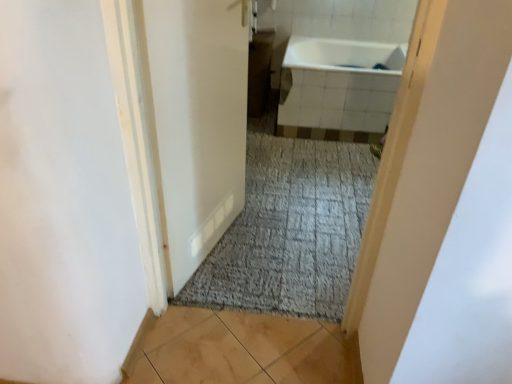
Question: Is white glossy door at center next to white glossy bathtub at upper center and touching it?

Choices:
 (A) yes
 (B) no

Answer: (B)

Question: Is white glossy door at center wider than white glossy bathtub at upper center?

Choices:
 (A) yes
 (B) no

Answer: (B)

Question: Is white glossy door at center positioned with its back to white glossy bathtub at upper center?

Choices:
 (A) no
 (B) yes

Answer: (A)

Question: Would you consider white glossy door at center to be distant from white glossy bathtub at upper center?

Choices:
 (A) yes
 (B) no

Answer: (A)

Question: From the image's perspective, is white glossy door at center above white glossy bathtub at upper center?

Choices:
 (A) yes
 (B) no

Answer: (B)

Question: Is light brown tile at lower center taller or shorter than white glossy bathtub at upper center?

Choices:
 (A) short
 (B) tall

Answer: (A)

Question: Based on their positions, is light brown tile at lower center located to the left or right of white glossy bathtub at upper center?

Choices:
 (A) left
 (B) right

Answer: (A)

Question: From the image's perspective, is light brown tile at lower center positioned above or below white glossy bathtub at upper center?

Choices:
 (A) above
 (B) below

Answer: (B)

Question: Based on their sizes in the image, would you say light brown tile at lower center is bigger or smaller than white glossy bathtub at upper center?

Choices:
 (A) small
 (B) big

Answer: (A)

Question: Would you say white glossy bathtub at upper center is to the left or to the right of light brown tile at lower center in the picture?

Choices:
 (A) left
 (B) right

Answer: (B)

Question: From a real-world perspective, is white glossy bathtub at upper center positioned above or below light brown tile at lower center?

Choices:
 (A) below
 (B) above

Answer: (B)

Question: From their relative heights in the image, would you say white glossy bathtub at upper center is taller or shorter than light brown tile at lower center?

Choices:
 (A) short
 (B) tall

Answer: (B)

Question: From the image's perspective, is white glossy bathtub at upper center located above or below light brown tile at lower center?

Choices:
 (A) below
 (B) above

Answer: (B)

Question: Considering their positions, is white glossy bathtub at upper center located in front of or behind white glossy door at center?

Choices:
 (A) front
 (B) behind

Answer: (B)

Question: Is point (382, 107) positioned closer to the camera than point (174, 278)?

Choices:
 (A) farther
 (B) closer

Answer: (A)